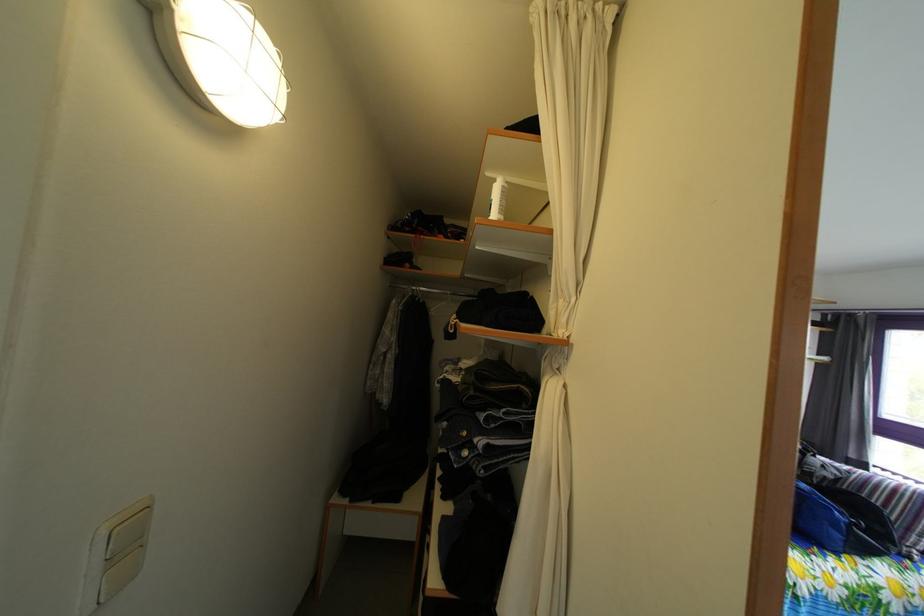
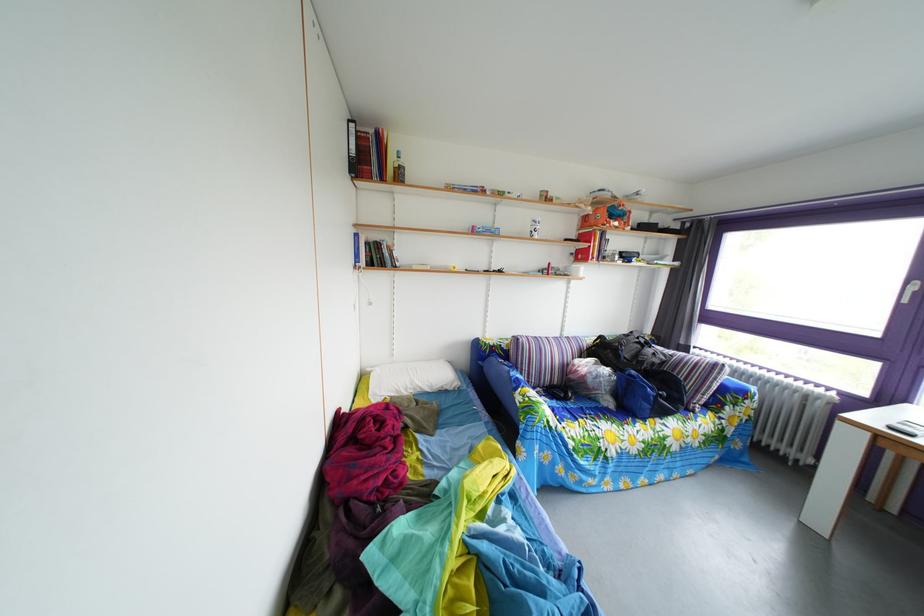
Question: How did the camera likely rotate?

Choices:
 (A) Left
 (B) Right
 (C) Up
 (D) Down

Answer: (D)